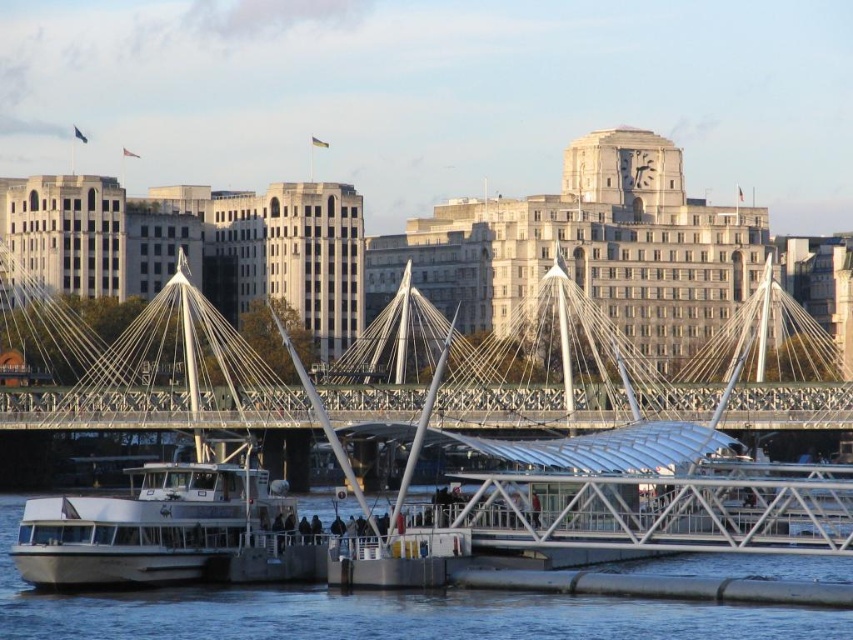
Question: Is clear water at lower center to the left of white matte boat at lower left from the viewer's perspective?

Choices:
 (A) yes
 (B) no

Answer: (B)

Question: Can you confirm if clear water at lower center is wider than white matte boat at lower left?

Choices:
 (A) yes
 (B) no

Answer: (A)

Question: Which of the following is the closest to the observer?

Choices:
 (A) clear water at lower center
 (B) white matte boat at lower left

Answer: (A)

Question: Is clear water at lower center to the left of white matte boat at lower left from the viewer's perspective?

Choices:
 (A) yes
 (B) no

Answer: (B)

Question: Which object is closer to the camera taking this photo?

Choices:
 (A) white matte boat at lower left
 (B) clear water at lower center

Answer: (B)

Question: Among these points, which one is farthest from the camera?

Choices:
 (A) (177, 577)
 (B) (413, 632)

Answer: (A)